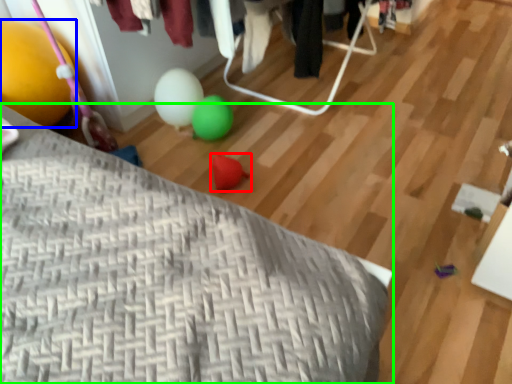
Question: Estimate the real-world distances between objects in this image. Which object is closer to toy (highlighted by a red box), balloon (highlighted by a blue box) or furniture (highlighted by a green box)?

Choices:
 (A) balloon
 (B) furniture

Answer: (A)